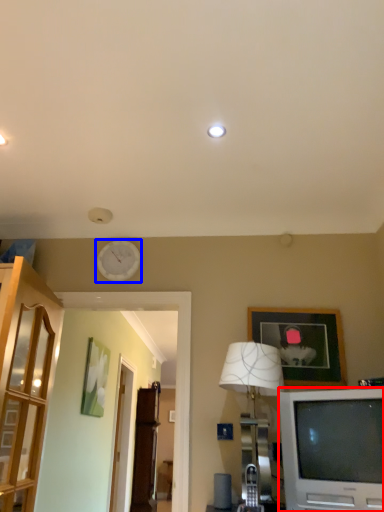
Question: Among these objects, which one is farthest to the camera, television (highlighted by a red box) or clock (highlighted by a blue box)?

Choices:
 (A) television
 (B) clock

Answer: (B)